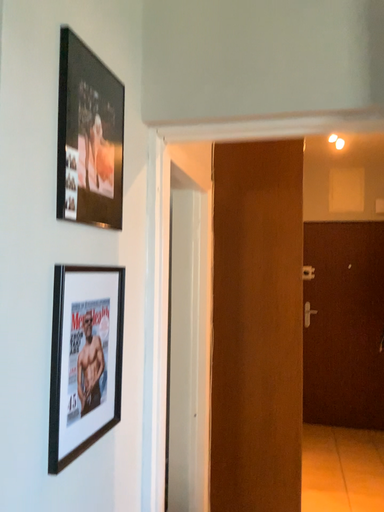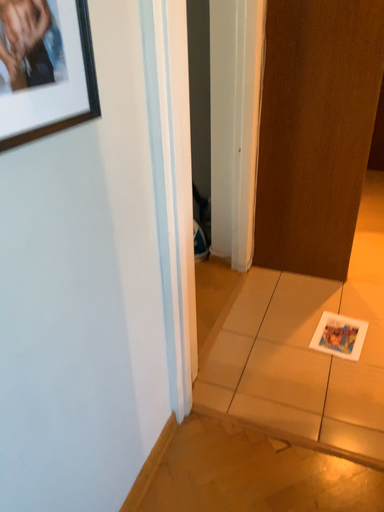
Question: How did the camera likely rotate when shooting the video?

Choices:
 (A) rotated upward
 (B) rotated downward

Answer: (B)